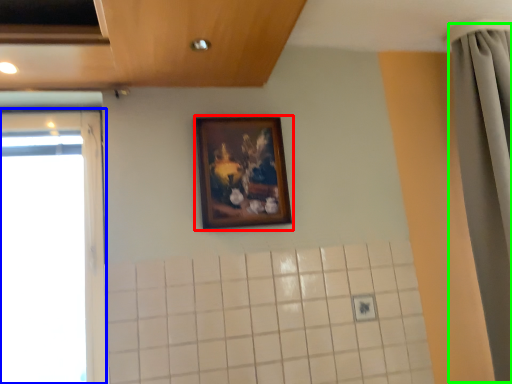
Question: Which object is the closest to the picture frame (highlighted by a red box)? Choose among these: window (highlighted by a blue box) or shower curtain (highlighted by a green box).

Choices:
 (A) window
 (B) shower curtain

Answer: (A)